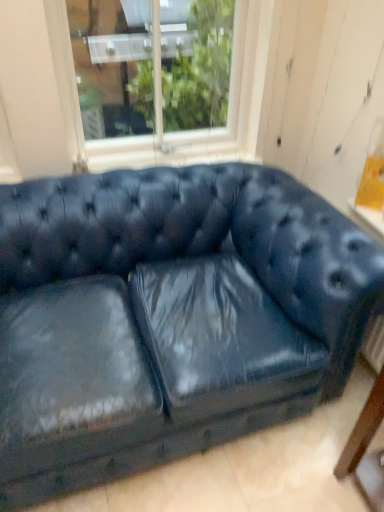
Describe the element at coordinates (168, 317) in the screenshot. I see `matte blue leather couch at center` at that location.

The image size is (384, 512). In order to click on matte blue leather couch at center in this screenshot , I will do `click(168, 317)`.

The height and width of the screenshot is (512, 384). Find the location of `white wood window at upper center`. white wood window at upper center is located at coordinates (161, 81).

This screenshot has width=384, height=512. What do you see at coordinates (161, 81) in the screenshot? I see `white wood window at upper center` at bounding box center [161, 81].

Where is `matte blue leather couch at center`? matte blue leather couch at center is located at coordinates (168, 317).

Between white wood window at upper center and matte blue leather couch at center, which one appears on the left side from the viewer's perspective?

white wood window at upper center.

Based on the photo, which object is closer to the camera taking this photo, white wood window at upper center or matte blue leather couch at center?

matte blue leather couch at center is closer to the camera.

Considering the positions of point (187, 50) and point (187, 410), is point (187, 50) closer or farther from the camera than point (187, 410)?

Point (187, 50) appears to be farther away from the viewer than point (187, 410).

From the image's perspective, between white wood window at upper center and matte blue leather couch at center, who is located below?

matte blue leather couch at center is shown below in the image.

From a real-world perspective, is white wood window at upper center on top of matte blue leather couch at center?

Yes.

Can you confirm if white wood window at upper center is wider than matte blue leather couch at center?

In fact, white wood window at upper center might be narrower than matte blue leather couch at center.

Considering the sizes of white wood window at upper center and matte blue leather couch at center in the image, is white wood window at upper center taller or shorter than matte blue leather couch at center?

Considering their sizes, white wood window at upper center has less height than matte blue leather couch at center.

Does white wood window at upper center have a larger size compared to matte blue leather couch at center?

A: Incorrect, white wood window at upper center is not larger than matte blue leather couch at center.

Is matte blue leather couch at center surrounded by white wood window at upper center?

No, matte blue leather couch at center is not surrounded by white wood window at upper center.

Are white wood window at upper center and matte blue leather couch at center making contact?

No, white wood window at upper center is not in contact with matte blue leather couch at center.

Is white wood window at upper center oriented away from matte blue leather couch at center?

white wood window at upper center is not turned away from matte blue leather couch at center.

Where is `window on the left of matte blue leather couch at center`? window on the left of matte blue leather couch at center is located at coordinates (161, 81).

Considering the relative positions of matte blue leather couch at center and white wood window at upper center in the image provided, is matte blue leather couch at center to the left or to the right of white wood window at upper center?

From the image, it's evident that matte blue leather couch at center is to the right of white wood window at upper center.

Is matte blue leather couch at center positioned behind white wood window at upper center?

No, matte blue leather couch at center is closer to the camera.

Does point (186, 212) come farther from viewer compared to point (85, 65)?

That is False.

From the image's perspective, is matte blue leather couch at center located above white wood window at upper center?

No.

From a real-world perspective, is matte blue leather couch at center positioned above or below white wood window at upper center?

From a real-world perspective, matte blue leather couch at center is physically below white wood window at upper center.

Which object is thinner, matte blue leather couch at center or white wood window at upper center?

white wood window at upper center.

Considering the relative sizes of matte blue leather couch at center and white wood window at upper center in the image provided, is matte blue leather couch at center shorter than white wood window at upper center?

Incorrect, the height of matte blue leather couch at center does not fall short of that of white wood window at upper center.

Between matte blue leather couch at center and white wood window at upper center, which one has larger size?

matte blue leather couch at center is bigger.

Is matte blue leather couch at center situated inside white wood window at upper center or outside?

matte blue leather couch at center is not enclosed by white wood window at upper center.

Is matte blue leather couch at center touching white wood window at upper center?

There is a gap between matte blue leather couch at center and white wood window at upper center.

Is matte blue leather couch at center looking in the opposite direction of white wood window at upper center?

No, matte blue leather couch at center is not facing the opposite direction of white wood window at upper center.

Image resolution: width=384 pixels, height=512 pixels. I want to click on studio couch on the right side of white wood window at upper center, so click(168, 317).

Where is `studio couch that is on the right side of white wood window at upper center`? This screenshot has width=384, height=512. studio couch that is on the right side of white wood window at upper center is located at coordinates (168, 317).

The height and width of the screenshot is (512, 384). What are the coordinates of `window above the matte blue leather couch at center (from the image's perspective)` in the screenshot? It's located at pyautogui.click(x=161, y=81).